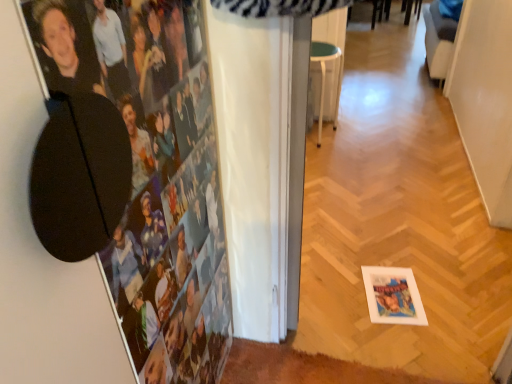
Question: Should I look upward or downward to see white plastic stool at center?

Choices:
 (A) up
 (B) down

Answer: (A)

Question: Is white plastic stool at center smaller than fabric swivel chair at upper right?

Choices:
 (A) no
 (B) yes

Answer: (B)

Question: From a real-world perspective, is white plastic stool at center physically above fabric swivel chair at upper right?

Choices:
 (A) no
 (B) yes

Answer: (A)

Question: From the image's perspective, is white plastic stool at center over fabric swivel chair at upper right?

Choices:
 (A) yes
 (B) no

Answer: (B)

Question: Could you tell me if white plastic stool at center is facing fabric swivel chair at upper right?

Choices:
 (A) no
 (B) yes

Answer: (A)

Question: Would you say white plastic stool at center contains fabric swivel chair at upper right?

Choices:
 (A) yes
 (B) no

Answer: (B)

Question: Is white plastic stool at center with fabric swivel chair at upper right?

Choices:
 (A) yes
 (B) no

Answer: (B)

Question: From a real-world perspective, is black matte photo frame at upper left physically below white plastic stool at center?

Choices:
 (A) no
 (B) yes

Answer: (A)

Question: Is black matte photo frame at upper left positioned far away from white plastic stool at center?

Choices:
 (A) no
 (B) yes

Answer: (B)

Question: From the image's perspective, does black matte photo frame at upper left appear higher than white plastic stool at center?

Choices:
 (A) no
 (B) yes

Answer: (A)

Question: Is black matte photo frame at upper left facing towards white plastic stool at center?

Choices:
 (A) no
 (B) yes

Answer: (A)

Question: Considering the relative sizes of black matte photo frame at upper left and white plastic stool at center in the image provided, is black matte photo frame at upper left smaller than white plastic stool at center?

Choices:
 (A) no
 (B) yes

Answer: (B)

Question: Is black matte photo frame at upper left bigger than white plastic stool at center?

Choices:
 (A) yes
 (B) no

Answer: (B)

Question: Is fabric swivel chair at upper right at the left side of black matte photo frame at upper left?

Choices:
 (A) no
 (B) yes

Answer: (A)